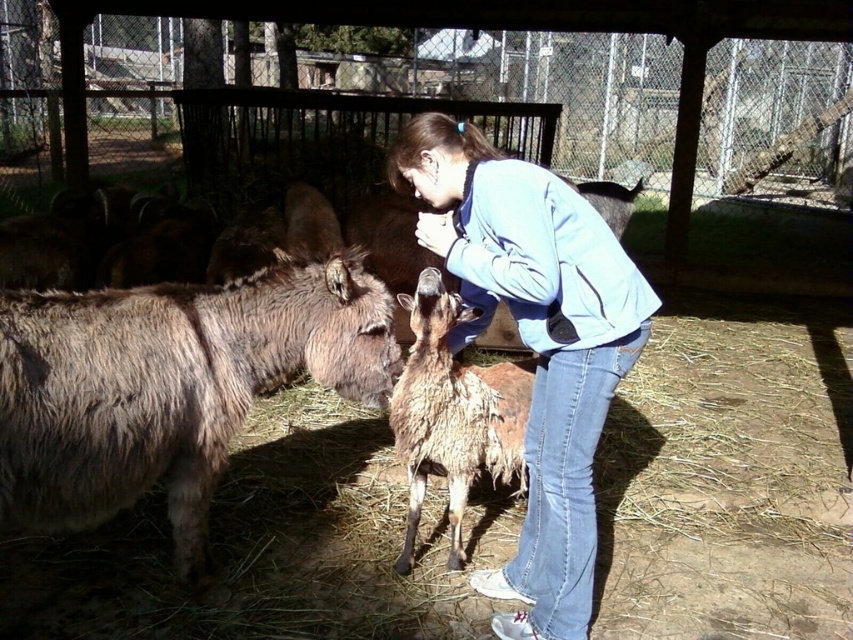
Question: Does fuzzy brown mule at left have a greater width compared to light blue denim jacket at center?

Choices:
 (A) yes
 (B) no

Answer: (A)

Question: Which point is farther to the camera?

Choices:
 (A) light blue denim jacket at center
 (B) fuzzy brown mule at left

Answer: (A)

Question: Estimate the real-world distances between objects in this image. Which object is closer to the fuzzy brown mule at left?

Choices:
 (A) light blue denim jacket at center
 (B) fuzzy brown goat at center

Answer: (B)

Question: Is fuzzy brown mule at left to the right of light blue denim jacket at center from the viewer's perspective?

Choices:
 (A) yes
 (B) no

Answer: (B)

Question: Which point is closer to the camera?

Choices:
 (A) (375, 339)
 (B) (451, 333)
 (C) (427, 424)

Answer: (A)

Question: Is the position of fuzzy brown mule at left more distant than that of fuzzy brown goat at center?

Choices:
 (A) no
 (B) yes

Answer: (A)